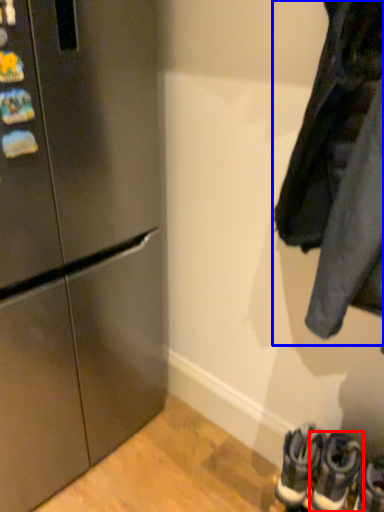
Question: Which object is closer to the camera taking this photo, footwear (highlighted by a red box) or jacket (highlighted by a blue box)?

Choices:
 (A) footwear
 (B) jacket

Answer: (B)